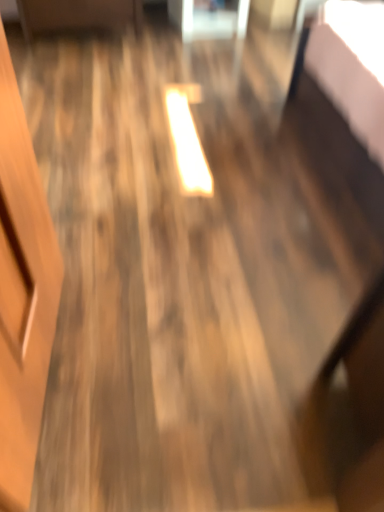
The width and height of the screenshot is (384, 512). Identify the location of vacant region under wooden door at left (from a real-world perspective). (57, 359).